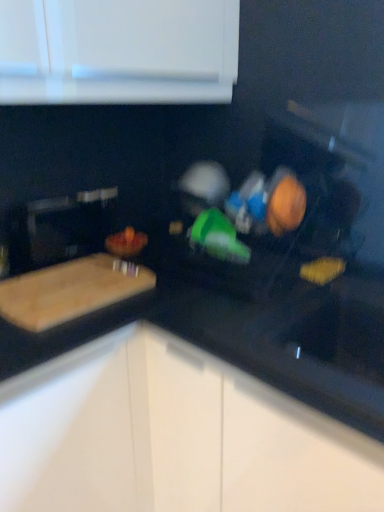
At what (x,y) coordinates should I click in order to perform the action: click on natural wood cutting board at left. Please return your answer as a coordinate pair (x, y). Image resolution: width=384 pixels, height=512 pixels. Looking at the image, I should click on (70, 291).

The image size is (384, 512). What do you see at coordinates (70, 291) in the screenshot?
I see `natural wood cutting board at left` at bounding box center [70, 291].

Describe the element at coordinates (285, 203) in the screenshot. Image resolution: width=384 pixels, height=512 pixels. I see `wooden bowl at center, acting as the 2th food starting from the left` at that location.

Identify the location of natural wood cutting board at left. This screenshot has height=512, width=384. (70, 291).

At what (x,y) coordinates should I click in order to perform the action: click on the 1st food positioned above the natural wood cutting board at left (from a real-world perspective). Please return your answer as a coordinate pair (x, y). Looking at the image, I should click on (322, 270).

Between yellow matte sponge at lower right, which is the second food in front-to-back order, and natural wood cutting board at left, which one has less height?

yellow matte sponge at lower right, which is the second food in front-to-back order.

From a real-world perspective, is yellow matte sponge at lower right, which is the second food in front-to-back order, physically below natural wood cutting board at left?

Incorrect, from a real-world perspective, yellow matte sponge at lower right, which is the second food in front-to-back order, is higher than natural wood cutting board at left.

From the picture: From the image's perspective, does wooden bowl at center, the third food in the back-to-front sequence, appear higher than orange matte bowl at center, marked as the third food in a right-to-left arrangement?

Yes, from the image's perspective, wooden bowl at center, the third food in the back-to-front sequence, is over orange matte bowl at center, marked as the third food in a right-to-left arrangement.

From the picture: Are wooden bowl at center, the third food in the back-to-front sequence, and orange matte bowl at center, positioned as the third food in front-to-back order, far apart?

wooden bowl at center, the third food in the back-to-front sequence, is actually quite close to orange matte bowl at center, positioned as the third food in front-to-back order.

Between wooden bowl at center, the second food positioned from the right, and orange matte bowl at center, which is the first food from left to right, which one has more height?

wooden bowl at center, the second food positioned from the right.

Is orange matte bowl at center, positioned as the third food in front-to-back order, at the back of black glossy countertop at center?

No, orange matte bowl at center, positioned as the third food in front-to-back order, is not at the back of black glossy countertop at center.

Is black glossy countertop at center positioned far away from orange matte bowl at center, which is the first food from left to right?

Actually, black glossy countertop at center and orange matte bowl at center, which is the first food from left to right, are a little close together.

Looking at their sizes, would you say black glossy countertop at center is wider or thinner than orange matte bowl at center, the first food when ordered from back to front?

black glossy countertop at center is wider than orange matte bowl at center, the first food when ordered from back to front.

Which is nearer, (185, 300) or (146, 241)?

The point (185, 300) is closer.

At what (x,y) coordinates should I click in order to perform the action: click on cutting board lying on the left of wooden bowl at center, placed as the 1th food when sorted from front to back. Please return your answer as a coordinate pair (x, y). This screenshot has height=512, width=384. Looking at the image, I should click on (70, 291).

From a real-world perspective, which object stands above the other?

From a 3D spatial view, wooden bowl at center, the second food positioned from the right, is above.

Does wooden bowl at center, the third food in the back-to-front sequence, appear on the right side of natural wood cutting board at left?

Yes.

Which is correct: wooden bowl at center, acting as the 2th food starting from the left, is inside natural wood cutting board at left, or outside of it?

wooden bowl at center, acting as the 2th food starting from the left, is located beyond the bounds of natural wood cutting board at left.

From a real-world perspective, which object stands above the other?

From a 3D spatial view, wooden bowl at center, placed as the 1th food when sorted from front to back, is above.

In terms of height, does yellow matte sponge at lower right, acting as the first food starting from the right, look taller or shorter compared to wooden bowl at center, the second food positioned from the right?

Considering their sizes, yellow matte sponge at lower right, acting as the first food starting from the right, has less height than wooden bowl at center, the second food positioned from the right.

Is yellow matte sponge at lower right, which is the second food in front-to-back order, far from wooden bowl at center, placed as the 1th food when sorted from front to back?

yellow matte sponge at lower right, which is the second food in front-to-back order, is near wooden bowl at center, placed as the 1th food when sorted from front to back, not far away.

From a real-world perspective, who is located lower, black glossy countertop at center or natural wood cutting board at left?

black glossy countertop at center, from a real-world perspective.

Can we say black glossy countertop at center lies outside natural wood cutting board at left?

That's correct, black glossy countertop at center is outside of natural wood cutting board at left.

Is natural wood cutting board at left at the back of black glossy countertop at center?

No, black glossy countertop at center is not facing the opposite direction of natural wood cutting board at left.

Is black glossy countertop at center wider or thinner than natural wood cutting board at left?

Clearly, black glossy countertop at center has more width compared to natural wood cutting board at left.

Measure the distance between yellow matte sponge at lower right, placed as the 2th food when sorted from back to front, and orange matte bowl at center, the first food when ordered from back to front.

yellow matte sponge at lower right, placed as the 2th food when sorted from back to front, is 24.71 inches from orange matte bowl at center, the first food when ordered from back to front.

Does yellow matte sponge at lower right, acting as the first food starting from the right, come behind orange matte bowl at center, positioned as the third food in front-to-back order?

No, it is not.

Is yellow matte sponge at lower right, positioned as the 3th food in left-to-right order, next to orange matte bowl at center, which is the first food from left to right, and touching it?

No, yellow matte sponge at lower right, positioned as the 3th food in left-to-right order, is not with orange matte bowl at center, which is the first food from left to right.

From their relative heights in the image, would you say yellow matte sponge at lower right, positioned as the 3th food in left-to-right order, is taller or shorter than orange matte bowl at center, the first food when ordered from back to front?

In the image, yellow matte sponge at lower right, positioned as the 3th food in left-to-right order, appears to be shorter than orange matte bowl at center, the first food when ordered from back to front.

In order to click on cutting board to the left of yellow matte sponge at lower right, acting as the first food starting from the right in this screenshot , I will do `click(70, 291)`.

This screenshot has height=512, width=384. In order to click on food that is the 2nd one when counting forward from the orange matte bowl at center, positioned as the third food in front-to-back order in this screenshot , I will do `click(285, 203)`.

Based on their spatial positions, is yellow matte sponge at lower right, which is the second food in front-to-back order, or orange matte bowl at center, marked as the third food in a right-to-left arrangement, closer to black glossy countertop at center?

yellow matte sponge at lower right, which is the second food in front-to-back order, lies closer to black glossy countertop at center than the other object.

Looking at the image, which one is located closer to natural wood cutting board at left, black glossy countertop at center or orange matte bowl at center, marked as the third food in a right-to-left arrangement?

The object closer to natural wood cutting board at left is black glossy countertop at center.

Considering their positions, is natural wood cutting board at left positioned further to yellow matte sponge at lower right, placed as the 2th food when sorted from back to front, than black glossy countertop at center?

natural wood cutting board at left is positioned further to the anchor yellow matte sponge at lower right, placed as the 2th food when sorted from back to front.

Based on their spatial positions, is yellow matte sponge at lower right, positioned as the 3th food in left-to-right order, or wooden bowl at center, the third food in the back-to-front sequence, further from natural wood cutting board at left?

Among the two, yellow matte sponge at lower right, positioned as the 3th food in left-to-right order, is located further to natural wood cutting board at left.

Which object lies further to the anchor point natural wood cutting board at left, wooden bowl at center, acting as the 2th food starting from the left, or yellow matte sponge at lower right, which is the second food in front-to-back order?

Among the two, yellow matte sponge at lower right, which is the second food in front-to-back order, is located further to natural wood cutting board at left.

Which object lies further to the anchor point orange matte bowl at center, positioned as the third food in front-to-back order, black glossy countertop at center or wooden bowl at center, placed as the 1th food when sorted from front to back?

The object further to orange matte bowl at center, positioned as the third food in front-to-back order, is wooden bowl at center, placed as the 1th food when sorted from front to back.

Which object lies further to the anchor point natural wood cutting board at left, black glossy countertop at center or wooden bowl at center, placed as the 1th food when sorted from front to back?

wooden bowl at center, placed as the 1th food when sorted from front to back.

When comparing their distances from wooden bowl at center, the second food positioned from the right, does yellow matte sponge at lower right, positioned as the 3th food in left-to-right order, or black glossy countertop at center seem further?

black glossy countertop at center is positioned further to the anchor wooden bowl at center, the second food positioned from the right.

You are a GUI agent. You are given a task and a screenshot of the screen. Output one action in this format:
    pyautogui.click(x=<x>, y=<y>)
    Task: Click on the food situated between natural wood cutting board at left and wooden bowl at center, acting as the 2th food starting from the left, from left to right
    This screenshot has width=384, height=512.
    Given the screenshot: What is the action you would take?
    pyautogui.click(x=126, y=243)

Find the location of a particular element. food between orange matte bowl at center, marked as the third food in a right-to-left arrangement, and yellow matte sponge at lower right, positioned as the 3th food in left-to-right order is located at coordinates (285, 203).

Identify the location of cutting board between black glossy countertop at center and orange matte bowl at center, which is the first food from left to right, along the z-axis. (70, 291).

This screenshot has height=512, width=384. Identify the location of countertop situated between natural wood cutting board at left and yellow matte sponge at lower right, which is the second food in front-to-back order, from left to right. (251, 337).